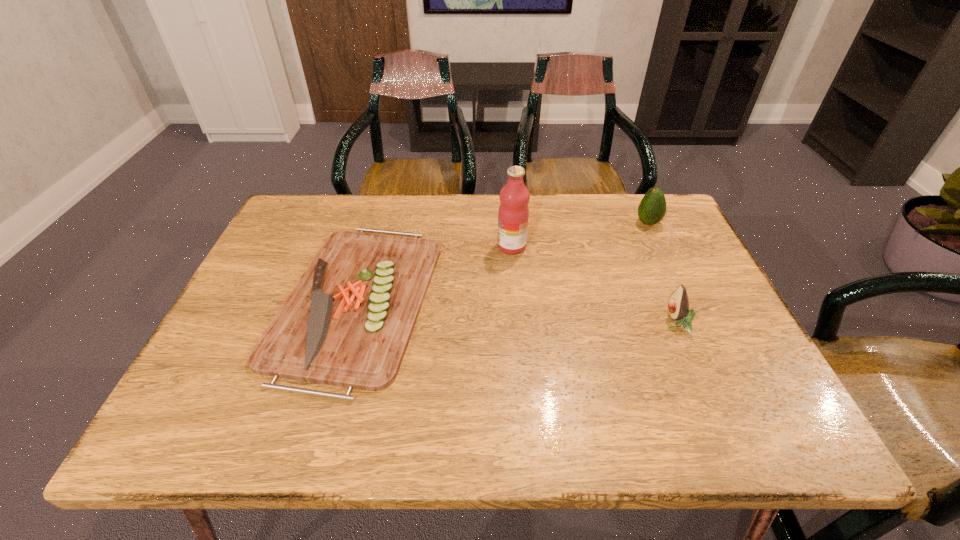
Where is `free location located on the seed side of the nearer avocado`? The width and height of the screenshot is (960, 540). free location located on the seed side of the nearer avocado is located at coordinates (620, 323).

I want to click on vacant space situated on the seed side of the nearer avocado, so click(493, 323).

At what (x,y) coordinates should I click in order to perform the action: click on vacant space located on the seed side of the nearer avocado. Please return your answer as a coordinate pair (x, y). Image resolution: width=960 pixels, height=540 pixels. Looking at the image, I should click on (529, 323).

Identify the location of free space located on the right of the chopping board. (515, 300).

I want to click on fruit juice that is at the far edge, so tap(513, 214).

At what (x,y) coordinates should I click in order to perform the action: click on avocado that is at the far edge. Please return your answer as a coordinate pair (x, y). Image resolution: width=960 pixels, height=540 pixels. Looking at the image, I should click on (652, 208).

The width and height of the screenshot is (960, 540). Find the location of `chopping board present at the far edge`. chopping board present at the far edge is located at coordinates (347, 322).

Locate an element on the screen. object present at the near edge is located at coordinates [x=347, y=322].

Identify the location of object positioned at the left edge. (347, 322).

Find the location of a particular element. object at the far left corner is located at coordinates pyautogui.click(x=347, y=322).